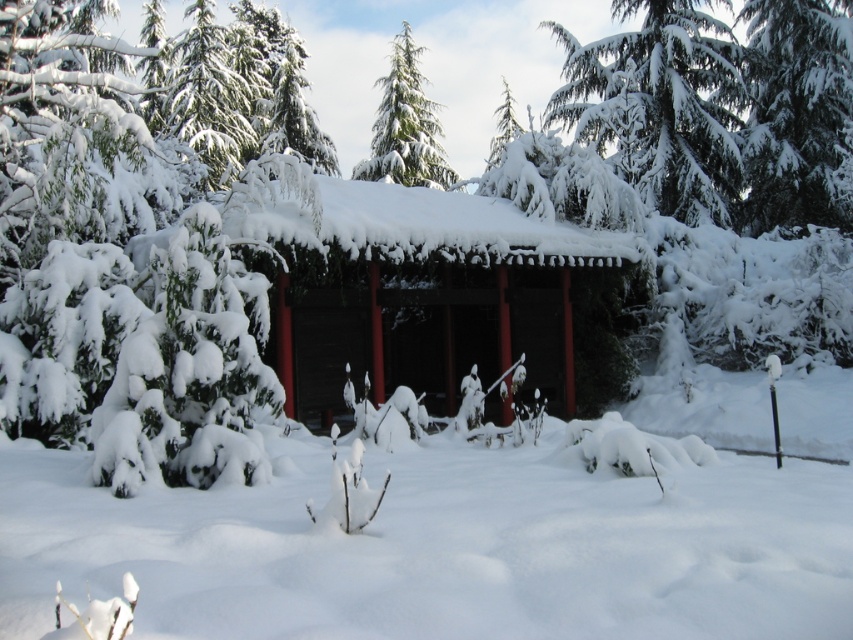
Question: Which point is farther from the camera taking this photo?

Choices:
 (A) (83, 524)
 (B) (315, 253)
 (C) (428, 177)

Answer: (C)

Question: Which of the following is the farthest from the observer?

Choices:
 (A) (810, 538)
 (B) (395, 248)

Answer: (B)

Question: Is white fluffy snow at center to the left of smooth wooden cabin at center from the viewer's perspective?

Choices:
 (A) no
 (B) yes

Answer: (A)

Question: Does white fluffy snow at center have a smaller size compared to green textured pine tree at center?

Choices:
 (A) no
 (B) yes

Answer: (B)

Question: Which point is farther to the camera?

Choices:
 (A) (399, 33)
 (B) (433, 550)

Answer: (A)

Question: Does white fluffy snow at center have a lesser width compared to green textured pine tree at center?

Choices:
 (A) yes
 (B) no

Answer: (B)